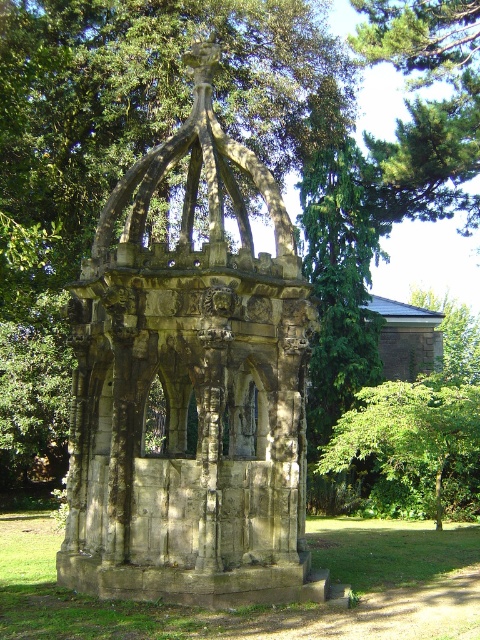
Question: Which of the following is the closest to the observer?

Choices:
 (A) green leafy tree at center
 (B) stone gazebo at center

Answer: (B)

Question: Which point is farther from the camera taking this photo?

Choices:
 (A) (300, 332)
 (B) (447, 394)

Answer: (B)

Question: Which point is closer to the camera?

Choices:
 (A) (384, 406)
 (B) (277, 195)

Answer: (B)

Question: Can you confirm if stone gazebo at center is thinner than green leafy tree at center?

Choices:
 (A) no
 (B) yes

Answer: (B)

Question: Can you confirm if stone gazebo at center is positioned to the left of green leafy tree at center?

Choices:
 (A) no
 (B) yes

Answer: (B)

Question: Can you confirm if stone gazebo at center is thinner than green leafy tree at center?

Choices:
 (A) yes
 (B) no

Answer: (A)